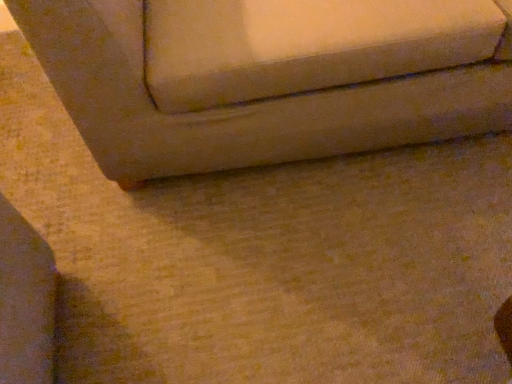
Question: Should I look upward or downward to see beige fabric couch at lower left?

Choices:
 (A) down
 (B) up

Answer: (B)